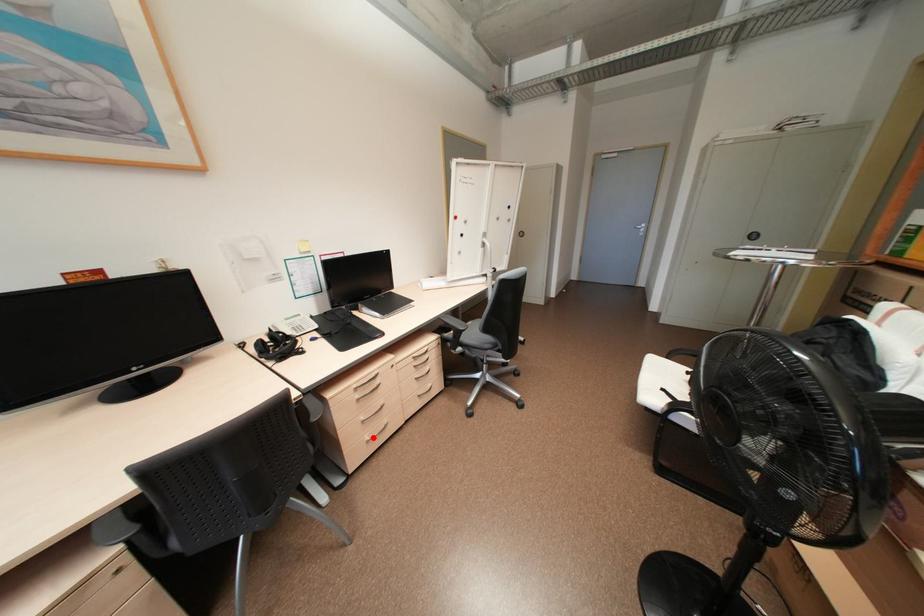
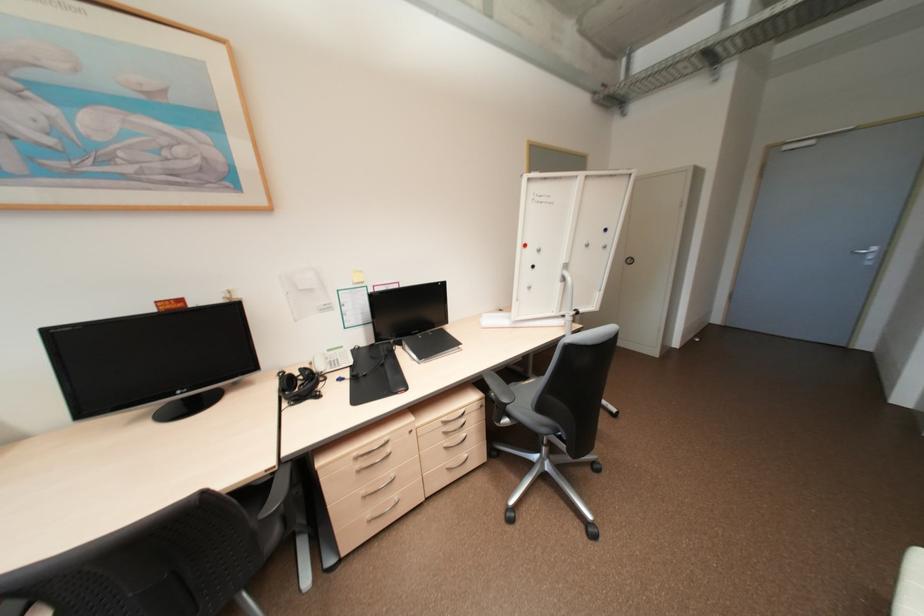
Find the pixel in the second image that matches the highlighted location in the first image.

(374, 516)